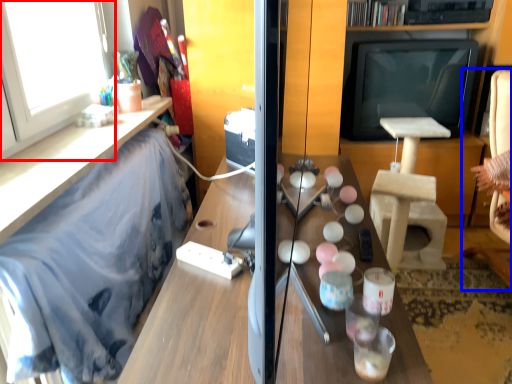
Question: Which object appears closest to the camera in this image, window (highlighted by a red box) or swivel chair (highlighted by a blue box)?

Choices:
 (A) window
 (B) swivel chair

Answer: (A)